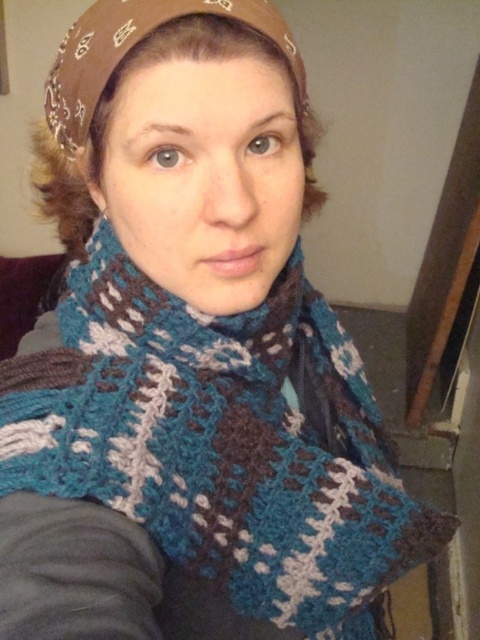
Who is taller, crochetmaterial/texturescarf at center or brown bandana at upper center?

With more height is crochetmaterial/texturescarf at center.

Describe the element at coordinates (220, 442) in the screenshot. I see `crochetmaterial/texturescarf at center` at that location.

The width and height of the screenshot is (480, 640). I want to click on crochetmaterial/texturescarf at center, so click(220, 442).